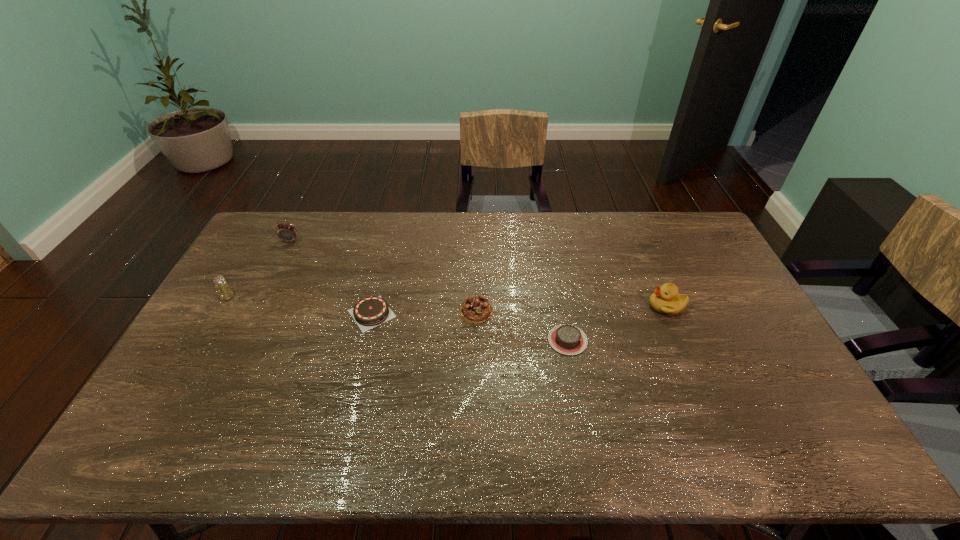
At what (x,y) coordinates should I click in order to perform the action: click on vacant position located 0.100m on the face of the fifth object from right to left. Please return your answer as a coordinate pair (x, y). Looking at the image, I should click on (280, 261).

The height and width of the screenshot is (540, 960). Identify the location of free space located 0.380m on the front-facing side of the rightmost object. (527, 306).

At what (x,y) coordinates should I click in order to perform the action: click on free space located 0.160m on the front-facing side of the rightmost object. Please return your answer as a coordinate pair (x, y). The height and width of the screenshot is (540, 960). Looking at the image, I should click on (597, 306).

Where is `free space located on the front-facing side of the rightmost object`? free space located on the front-facing side of the rightmost object is located at coordinates (633, 306).

At what (x,y) coordinates should I click in order to perform the action: click on free spot located 0.160m on the front of the leftmost object. Please return your answer as a coordinate pair (x, y). The width and height of the screenshot is (960, 540). Looking at the image, I should click on (202, 341).

Image resolution: width=960 pixels, height=540 pixels. In order to click on blank space located on the front of the third object from right to left in this screenshot , I will do `click(475, 384)`.

At what (x,y) coordinates should I click in order to perform the action: click on free space located 0.130m on the left of the leftmost chocolate cake. Please return your answer as a coordinate pair (x, y). Looking at the image, I should click on (304, 313).

The width and height of the screenshot is (960, 540). I want to click on free space located on the right of the shortest chocolate cake, so click(x=718, y=340).

At what (x,y) coordinates should I click in order to perform the action: click on object located at the far edge. Please return your answer as a coordinate pair (x, y). The height and width of the screenshot is (540, 960). Looking at the image, I should click on (286, 232).

The height and width of the screenshot is (540, 960). Identify the location of alarm clock that is at the left edge. (286, 232).